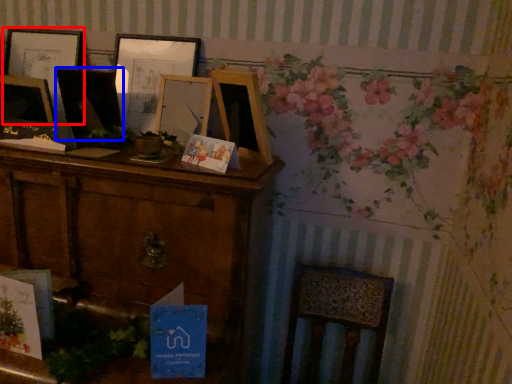
Question: Among these objects, which one is nearest to the camera, picture frame (highlighted by a red box) or picture frame (highlighted by a blue box)?

Choices:
 (A) picture frame
 (B) picture frame

Answer: (B)